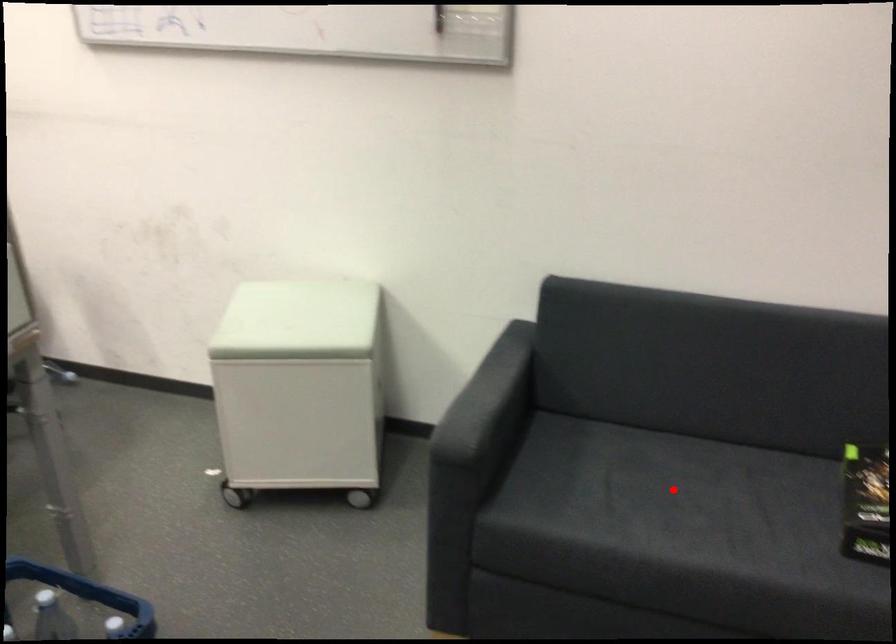
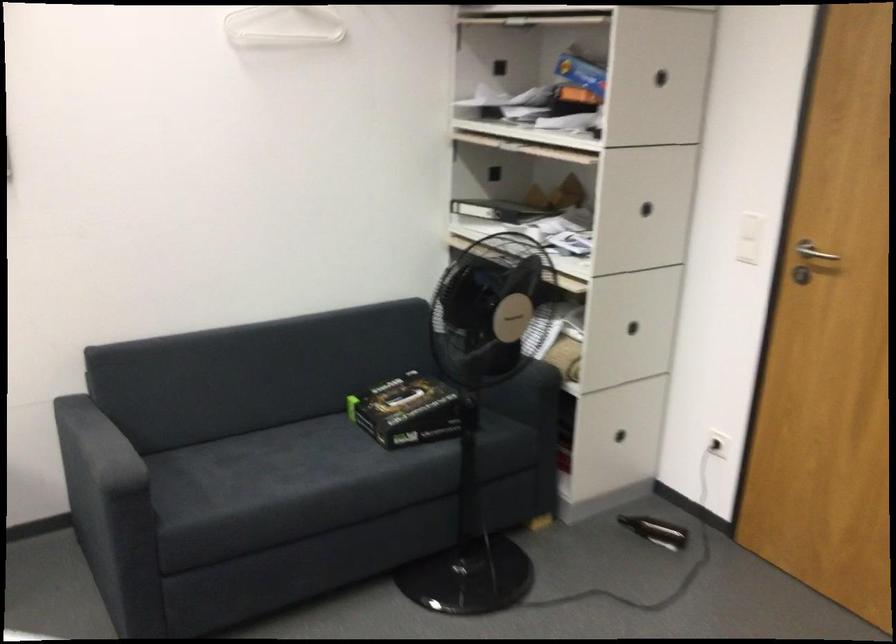
In the second image, find the point that corresponds to the highlighted location in the first image.

(268, 462)